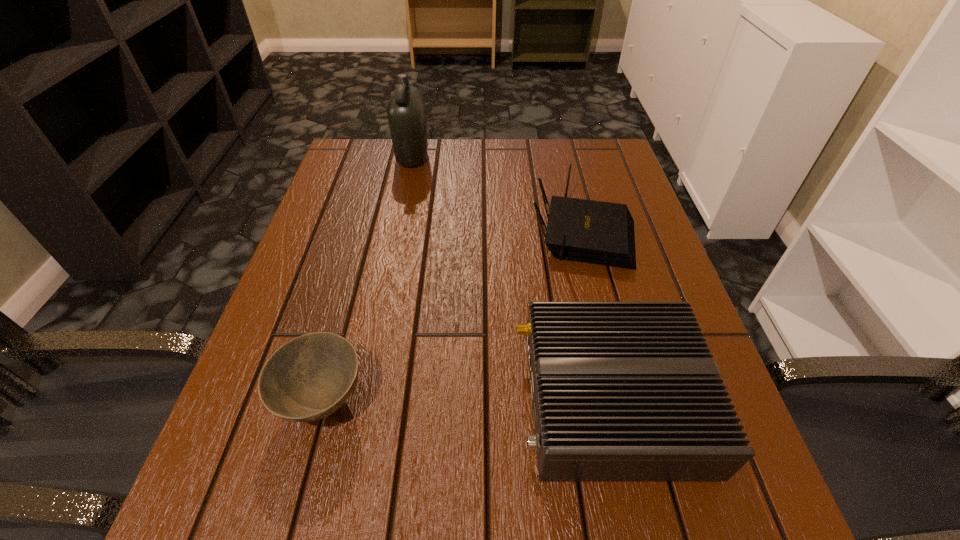
The width and height of the screenshot is (960, 540). Find the location of `vacant space at the near left corner of the desktop`. vacant space at the near left corner of the desktop is located at coordinates (198, 538).

The width and height of the screenshot is (960, 540). I want to click on free space at the far right corner, so click(622, 160).

The height and width of the screenshot is (540, 960). Identify the location of free space between the third nearest object and the tallest object. click(497, 195).

This screenshot has height=540, width=960. I want to click on empty space that is in between the farther router and the bowl, so click(x=453, y=316).

Identify the location of free space between the tallest object and the farther router. Image resolution: width=960 pixels, height=540 pixels. (497, 195).

Where is `empty space between the nearer router and the bowl`? The width and height of the screenshot is (960, 540). empty space between the nearer router and the bowl is located at coordinates (468, 400).

Locate an element on the screen. This screenshot has height=540, width=960. free space between the nearer router and the tallest object is located at coordinates (512, 278).

Locate an element on the screen. Image resolution: width=960 pixels, height=540 pixels. free space between the bowl and the bottle is located at coordinates (368, 279).

At what (x,y) coordinates should I click in order to perform the action: click on vacant area between the farthest object and the bowl. Please return your answer as a coordinate pair (x, y). The height and width of the screenshot is (540, 960). Looking at the image, I should click on (368, 279).

This screenshot has height=540, width=960. What are the coordinates of `empty space that is in between the bottle and the nearer router` in the screenshot? It's located at (512, 278).